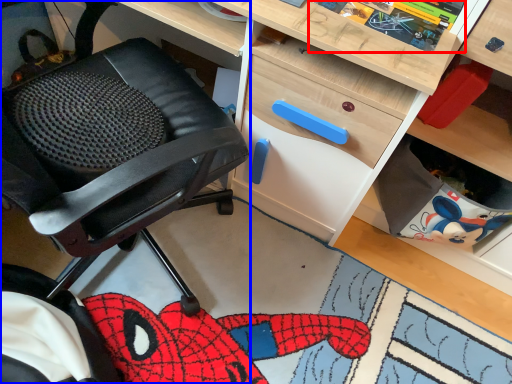
Question: Which object is further to the camera taking this photo, comic book (highlighted by a red box) or chair (highlighted by a blue box)?

Choices:
 (A) comic book
 (B) chair

Answer: (A)